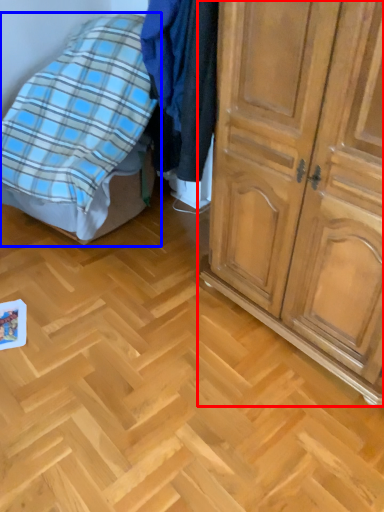
Question: Which point is closer to the camera, cupboard (highlighted by a red box) or bed (highlighted by a blue box)?

Choices:
 (A) cupboard
 (B) bed

Answer: (A)